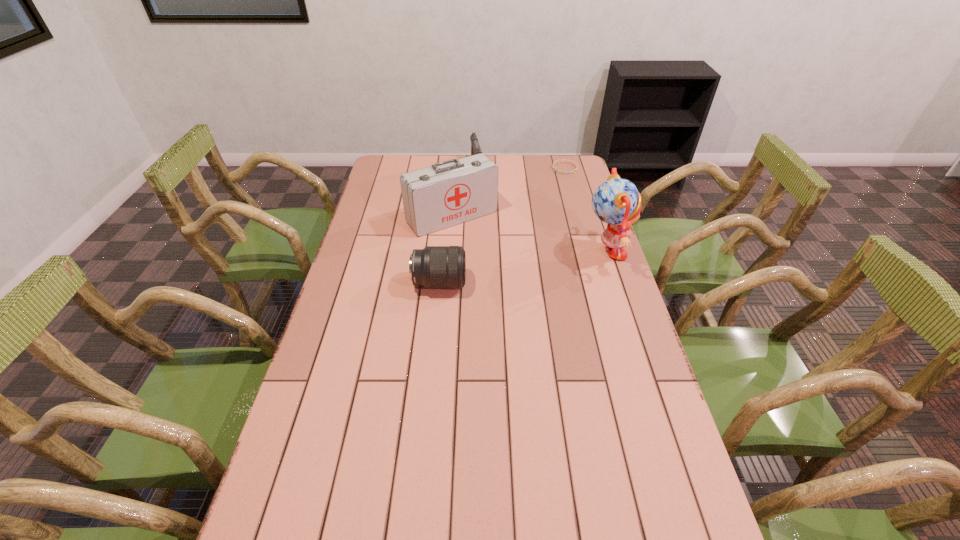
The width and height of the screenshot is (960, 540). Identify the location of free space located 0.170m in the direction the gun is aimed. (483, 199).

Where is `blank space located 0.260m in the direction the gun is aimed`? This screenshot has height=540, width=960. blank space located 0.260m in the direction the gun is aimed is located at coordinates (487, 212).

Locate an element on the screen. The height and width of the screenshot is (540, 960). free space located 0.130m on the surface of the shortest object showing star-shaped elements is located at coordinates (557, 190).

Locate an element on the screen. free space located 0.370m on the surface of the shortest object showing star-shaped elements is located at coordinates (545, 222).

The width and height of the screenshot is (960, 540). I want to click on vacant area located on the surface of the shortest object showing star-shaped elements, so click(549, 212).

Where is `gun positioned at the far edge`? The image size is (960, 540). gun positioned at the far edge is located at coordinates (475, 147).

I want to click on bracelet that is positioned at the far edge, so click(x=576, y=165).

This screenshot has width=960, height=540. In order to click on doll at the right edge in this screenshot , I will do `click(617, 202)`.

Where is `bracelet at the right edge`? bracelet at the right edge is located at coordinates (576, 165).

The height and width of the screenshot is (540, 960). I want to click on object that is at the far right corner, so click(576, 165).